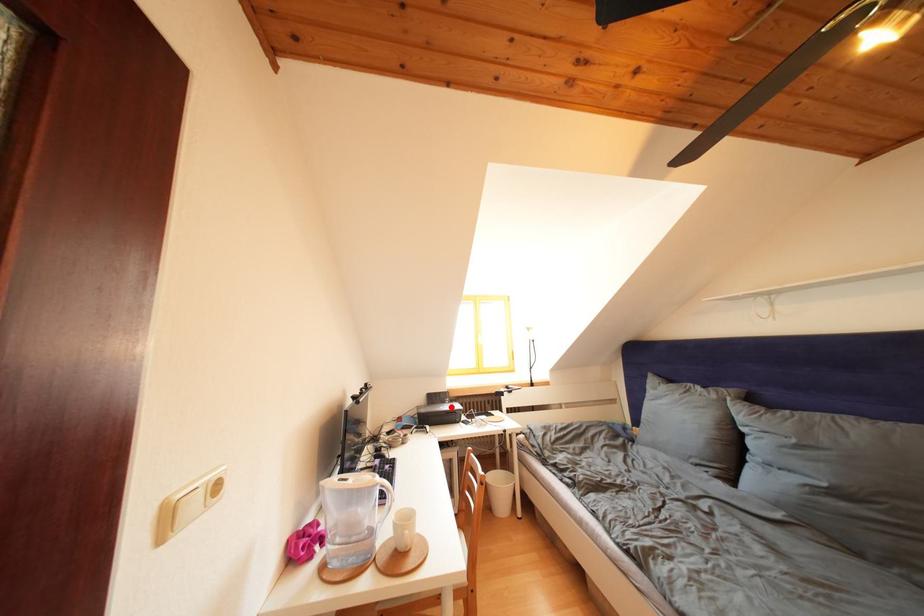
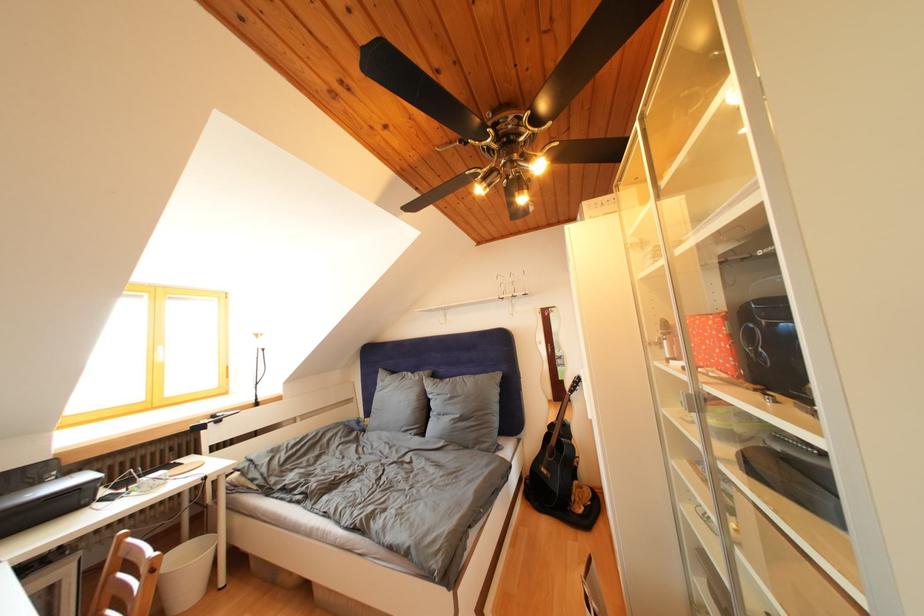
Find the pixel in the second image that matches the highlighted location in the first image.

(44, 488)